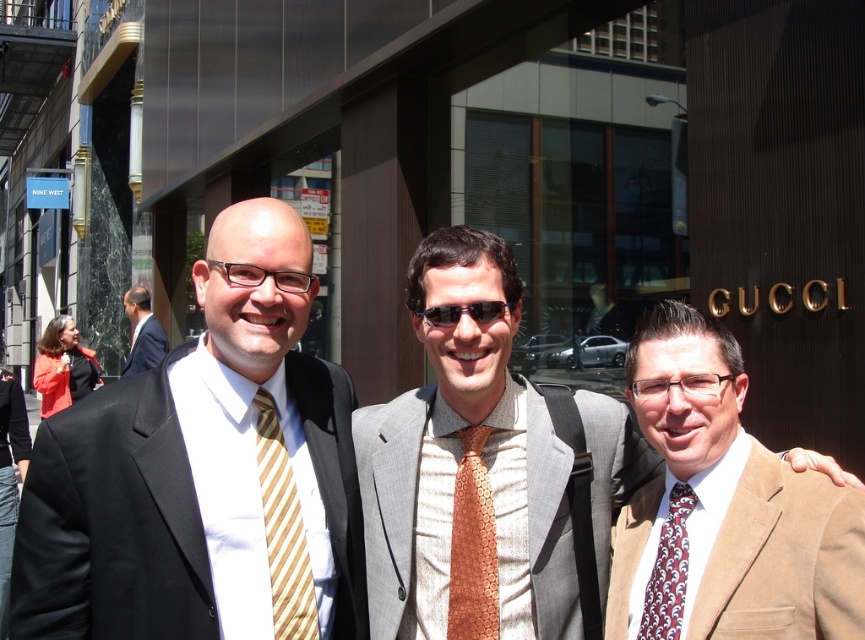
You are a fashion designer observing the three men outside the Gucci store. You need to determine which item of clothing is shorter in height between the yellow striped tie at center and the black suit at left. Based on the scene description, which one is shorter?

The yellow striped tie at center is not as tall as the black suit at left, so the yellow striped tie at center is shorter in height.

You are a fashion designer observing three men outside a Gucci store. You notice the yellow striped tie at center and the black suit at left. Which of these two items is positioned to the right in the scene?

The yellow striped tie at center is positioned to the right of the black suit at left.

You are a photographer standing 3 meters away from the matte black suit at left. You want to take a photo of all three men without moving the subjects. Can you capture them in one frame without zooming in? Explain your reasoning.

The three men are 2.51 meters apart. Since you are 3 meters away from the matte black suit at left, the distance between you and the farthest man would be approximately 5.51 meters. However, standard camera lenses typically have a field of view wide enough to capture subjects within this range without zooming. Therefore, it should be possible to include all three men in a single frame without moving them or adjusting the zoom.